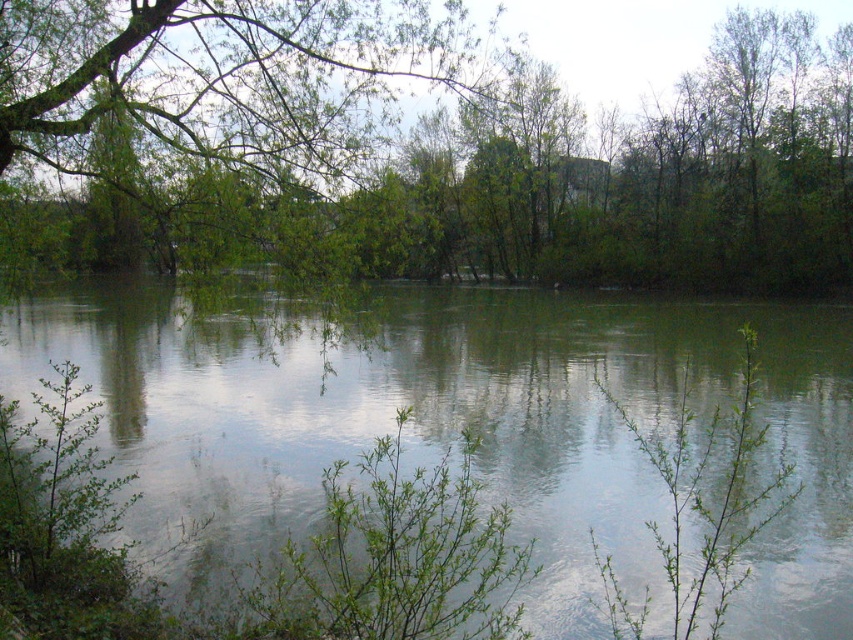
Question: Is green leafy tree at center behind green reflective water at center?

Choices:
 (A) yes
 (B) no

Answer: (A)

Question: Among these points, which one is farthest from the camera?

Choices:
 (A) pos(815,321)
 (B) pos(399,164)

Answer: (A)

Question: Considering the relative positions of green leafy tree at center and green reflective water at center in the image provided, where is green leafy tree at center located with respect to green reflective water at center?

Choices:
 (A) left
 (B) right

Answer: (B)

Question: Is green leafy tree at center thinner than green reflective water at center?

Choices:
 (A) no
 (B) yes

Answer: (B)

Question: Which of the following is the farthest from the observer?

Choices:
 (A) (245, 157)
 (B) (566, 620)

Answer: (A)